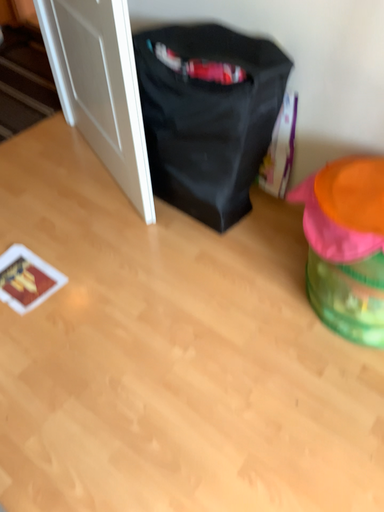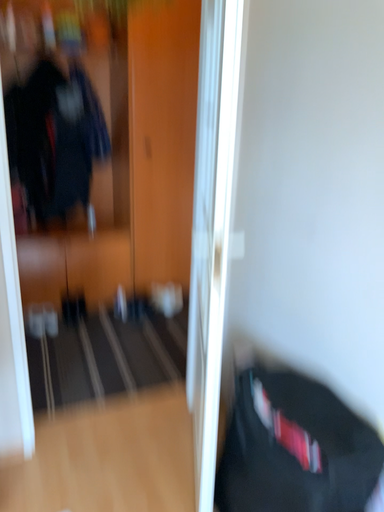
Question: Which way did the camera rotate in the video?

Choices:
 (A) rotated left
 (B) rotated right

Answer: (A)